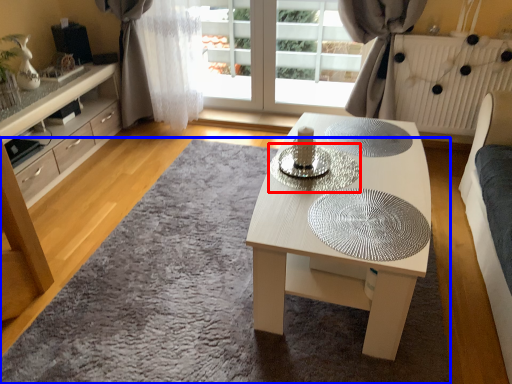
Question: Which object is further to the camera taking this photo, glass plate (highlighted by a red box) or mat (highlighted by a blue box)?

Choices:
 (A) glass plate
 (B) mat

Answer: (A)